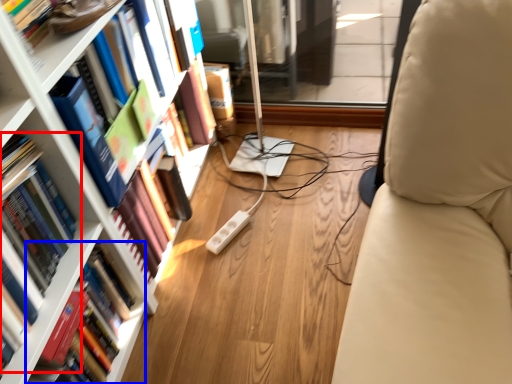
Question: Which object is closer to the camera taking this photo, book (highlighted by a red box) or book (highlighted by a blue box)?

Choices:
 (A) book
 (B) book

Answer: (A)